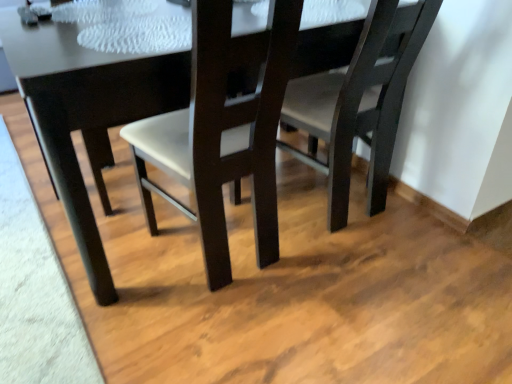
I want to click on vacant area that is in front of matte black table at center, so click(x=241, y=326).